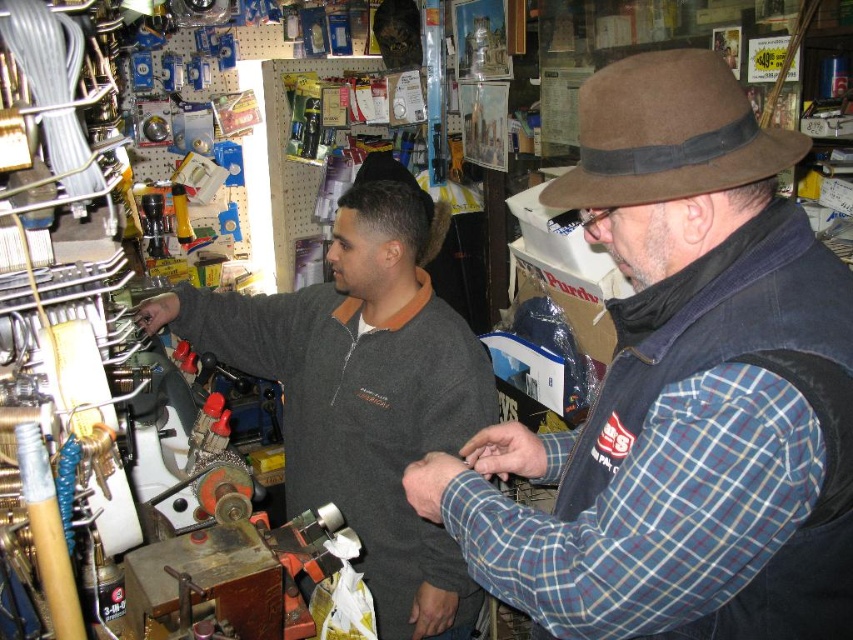
Can you confirm if brown felt hat at upper right is taller than dark gray sweater at center?

No.

How distant is brown felt hat at upper right from dark gray sweater at center?

brown felt hat at upper right and dark gray sweater at center are 29.15 inches apart.

Is point (691, 237) positioned after point (421, 218)?

No, (691, 237) is in front of (421, 218).

This screenshot has height=640, width=853. In order to click on brown felt hat at upper right in this screenshot , I will do `click(682, 392)`.

Which is below, brown felt hat at upper right or brown suede fedora at upper right?

Positioned lower is brown felt hat at upper right.

Is brown felt hat at upper right below brown suede fedora at upper right?

Indeed, brown felt hat at upper right is positioned under brown suede fedora at upper right.

Describe the element at coordinates (682, 392) in the screenshot. I see `brown felt hat at upper right` at that location.

The height and width of the screenshot is (640, 853). In order to click on brown felt hat at upper right in this screenshot , I will do `click(682, 392)`.

Does dark gray sweater at center appear on the left side of brown suede fedora at upper right?

Yes, dark gray sweater at center is to the left of brown suede fedora at upper right.

Locate an element on the screen. This screenshot has height=640, width=853. dark gray sweater at center is located at coordinates (363, 396).